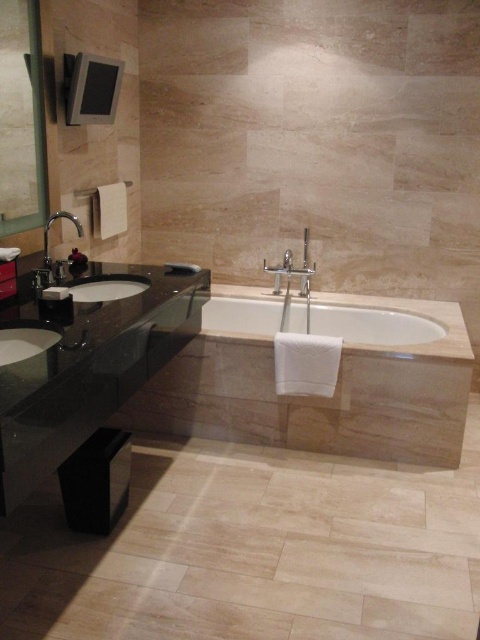
You are a delivery person carrying a package that is 2.5 meters long. You need to place it between the white marble bathtub at center and the black countertop with two sinks on the left. Is there enough space to fit the package between them?

The distance between the white marble bathtub at center and the black countertop with two sinks on the left is 2.53 meters. Since the package is 2.5 meters long, there is enough space to fit it between them with a small gap remaining.

In the modern bathroom, there are two sinks. The first is the white glossy sink at lower left and the second is the white glossy sink at left. From the perspective of someone standing in front of the bathroom, which sink is positioned more to the left?

The white glossy sink at lower left is positioned more to the left compared to the white glossy sink at left.

You are standing in the bathroom and want to place a new decorative plant between the white marble bathtub at center and the white glossy sink at lower left. According to the layout, which side of the sink should the plant be placed to ensure it is between them?

The white marble bathtub at center is positioned on the right side of the white glossy sink at lower left. Therefore, placing the plant to the right of the white glossy sink at lower left would position it between the two objects.